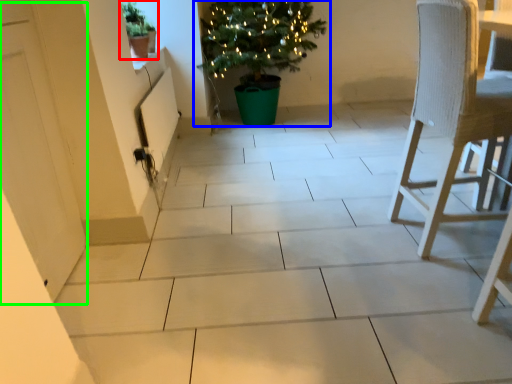
Question: Which is farther away from houseplant (highlighted by a red box)? houseplant (highlighted by a blue box) or screen door (highlighted by a green box)?

Choices:
 (A) houseplant
 (B) screen door

Answer: (B)